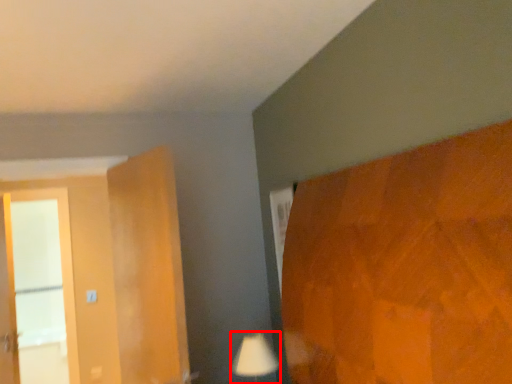
Question: Where is table lamp (annotated by the red box) located in relation to screen door in the image?

Choices:
 (A) left
 (B) right

Answer: (B)